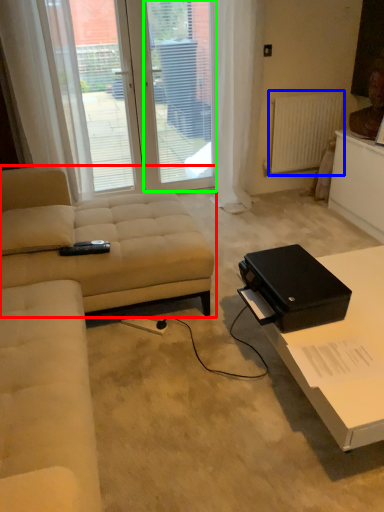
Question: Considering the real-world distances, which object is farthest from studio couch (highlighted by a red box)? radiator (highlighted by a blue box) or screen door (highlighted by a green box)?

Choices:
 (A) radiator
 (B) screen door

Answer: (A)